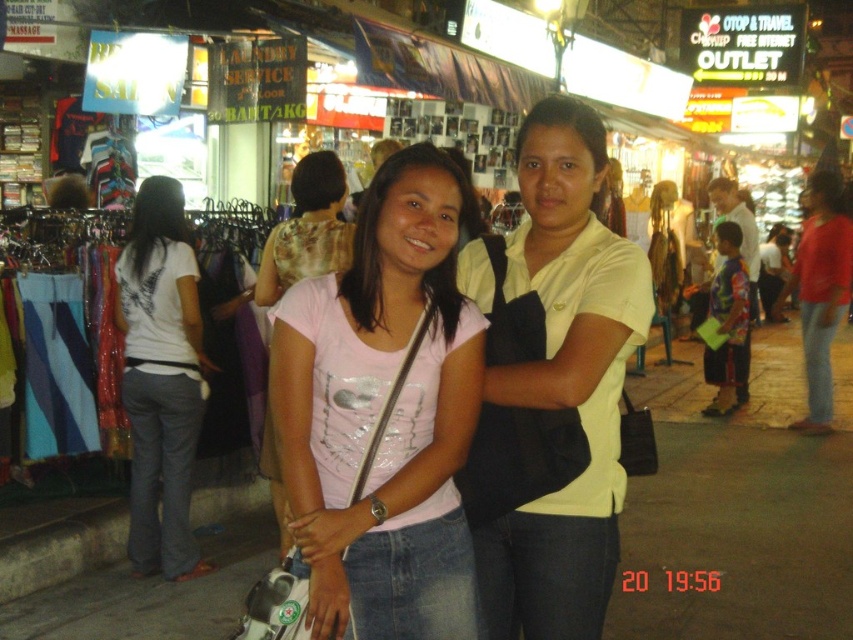
Where is `yellow matte shirt at center`? This screenshot has height=640, width=853. yellow matte shirt at center is located at coordinates (566, 380).

You are a GUI agent. You are given a task and a screenshot of the screen. Output one action in this format:
    pyautogui.click(x=<x>, y=<y>)
    Task: Click on the yellow matte shirt at center
    Image resolution: width=853 pixels, height=640 pixels.
    Given the screenshot: What is the action you would take?
    pyautogui.click(x=566, y=380)

Describe the element at coordinates (566, 380) in the screenshot. I see `yellow matte shirt at center` at that location.

Is point (602, 352) farther from viewer compared to point (341, 257)?

No, it is not.

Is point (527, 636) farther from viewer compared to point (323, 200)?

No, it is not.

Locate an element on the screen. yellow matte shirt at center is located at coordinates (566, 380).

Between white cotton shirt at left and pink fabric shirt at center, which one appears on the left side from the viewer's perspective?

white cotton shirt at left is more to the left.

Is white cotton shirt at left shorter than pink fabric shirt at center?

In fact, white cotton shirt at left may be taller than pink fabric shirt at center.

The height and width of the screenshot is (640, 853). What are the coordinates of `white cotton shirt at left` in the screenshot? It's located at (160, 378).